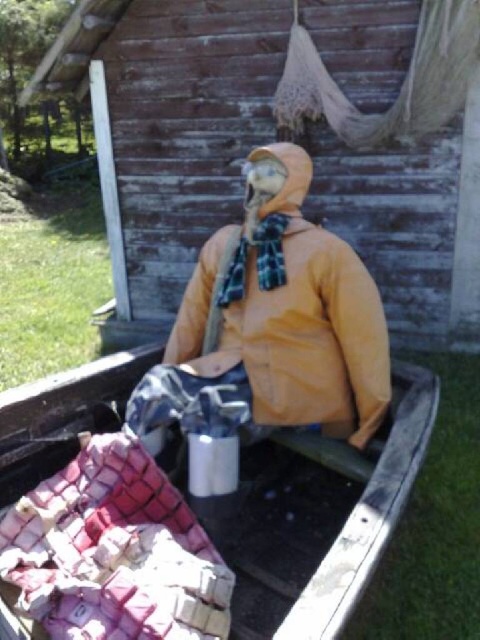
Which of these two, wooden hut at center or yellow matte jacket at center, stands shorter?

yellow matte jacket at center

Is wooden hut at center closer to camera compared to yellow matte jacket at center?

No, wooden hut at center is further to the viewer.

What do you see at coordinates (289, 134) in the screenshot? I see `wooden hut at center` at bounding box center [289, 134].

Locate an element on the screen. The width and height of the screenshot is (480, 640). wooden hut at center is located at coordinates (289, 134).

This screenshot has height=640, width=480. Describe the element at coordinates (324, 518) in the screenshot. I see `wooden boat at center` at that location.

Can you confirm if wooden boat at center is shorter than yellow matte jacket at center?

Yes, wooden boat at center is shorter than yellow matte jacket at center.

Which is behind, point (4, 486) or point (303, 243)?

The point (303, 243) is behind.

Where is `wooden boat at center`? wooden boat at center is located at coordinates (324, 518).

Is wooden hut at center shorter than wooden boat at center?

In fact, wooden hut at center may be taller than wooden boat at center.

Who is more distant from viewer, (479, 291) or (321, 637)?

The point (479, 291) is behind.

Find the location of a particular element. This screenshot has width=480, height=640. wooden hut at center is located at coordinates (289, 134).